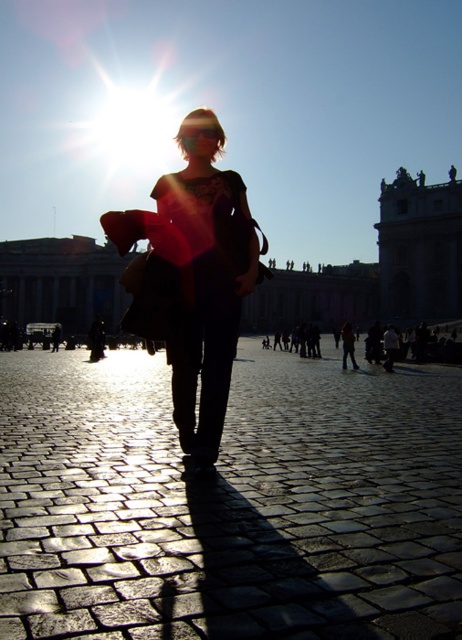
Does cobblestone plaza at center have a greater width compared to matte stone building at center?

Indeed, cobblestone plaza at center has a greater width compared to matte stone building at center.

Between cobblestone plaza at center and matte stone building at center, which one appears on the left side from the viewer's perspective?

matte stone building at center is more to the left.

This screenshot has height=640, width=462. In order to click on cobblestone plaza at center in this screenshot , I will do pyautogui.click(x=229, y=502).

Can you confirm if matte black coat at center is positioned above orange fabric bag at center?

Yes, matte black coat at center is above orange fabric bag at center.

Which is in front, point (245, 269) or point (342, 344)?

Point (245, 269)

Locate an element on the screen. matte black coat at center is located at coordinates tap(198, 282).

Based on the photo, can you confirm if matte black coat at center is shorter than matte stone building at center?

No.

Based on the photo, can you confirm if matte black coat at center is smaller than matte stone building at center?

Yes, matte black coat at center is smaller than matte stone building at center.

The height and width of the screenshot is (640, 462). I want to click on matte black coat at center, so click(x=198, y=282).

The width and height of the screenshot is (462, 640). In order to click on matte black coat at center in this screenshot , I will do `click(198, 282)`.